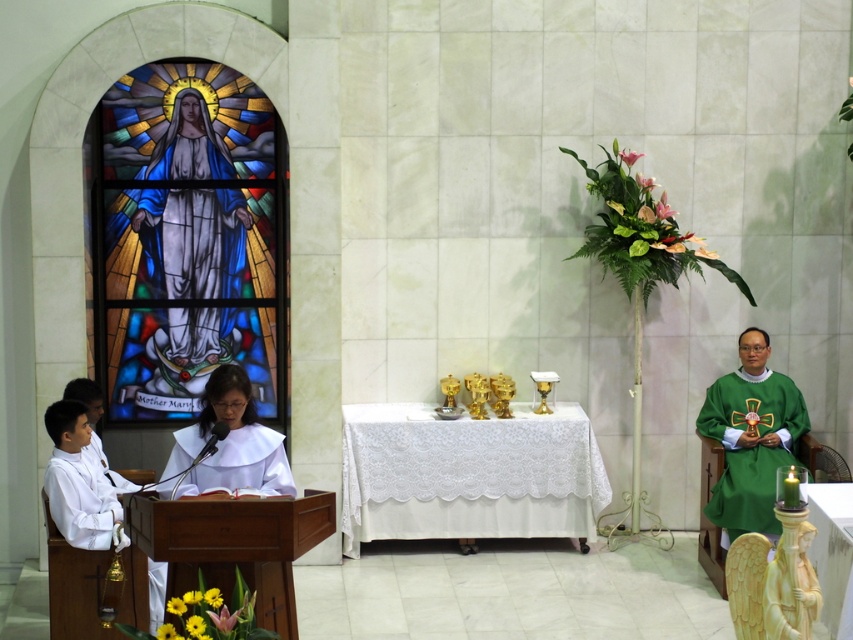
Question: Is stained glass at left smaller than translucent glass robe at upper left?

Choices:
 (A) no
 (B) yes

Answer: (A)

Question: Which object is positioned farthest from the white matte robe at left?

Choices:
 (A) translucent glass robe at upper left
 (B) white clothed figure at center
 (C) stained glass at left
 (D) green satin robe at right

Answer: (D)

Question: Is the position of translucent glass robe at upper left more distant than that of green satin robe at right?

Choices:
 (A) yes
 (B) no

Answer: (A)

Question: Which of these objects is positioned farthest from the white matte robe at left?

Choices:
 (A) green satin robe at right
 (B) translucent glass robe at upper left

Answer: (A)

Question: Estimate the real-world distances between objects in this image. Which object is farther from the stained glass at left?

Choices:
 (A) green satin robe at right
 (B) white clothed figure at center

Answer: (A)

Question: Is translucent glass robe at upper left wider than green satin robe at right?

Choices:
 (A) no
 (B) yes

Answer: (B)